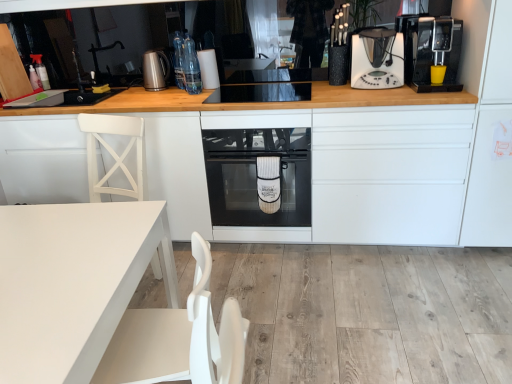
At what (x,y) coordinates should I click in order to perform the action: click on vacant space in front of white plastic coffee maker at upper right, acting as the second kitchen appliance starting from the right. Please return your answer as a coordinate pair (x, y). Looking at the image, I should click on pyautogui.click(x=378, y=90).